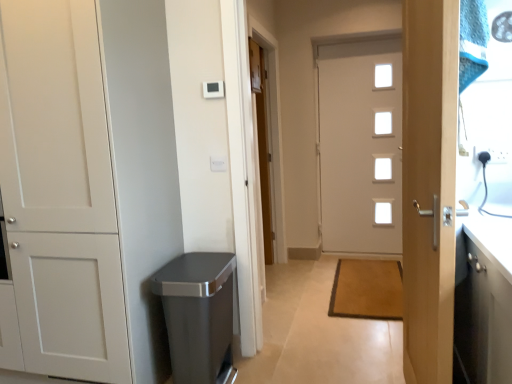
Consider the image. What is the approximate height of satin silver trash can at lower left?

satin silver trash can at lower left is 25.94 inches in height.

Locate an element on the screen. Image resolution: width=512 pixels, height=384 pixels. brown textured mat at center is located at coordinates 367,290.

Describe the element at coordinates (367, 290) in the screenshot. I see `brown textured mat at center` at that location.

How much space does white glossy door at center, which appears as the 3th door when viewed from the front, occupy vertically?

It is 6.91 feet.

You are a GUI agent. You are given a task and a screenshot of the screen. Output one action in this format:
    pyautogui.click(x=<x>, y=<y>)
    Task: Click on the light wood door handle at right, the third door positioned from the left
    The width and height of the screenshot is (512, 384).
    Given the screenshot: What is the action you would take?
    tap(429, 186)

Locate an element on the screen. Image resolution: width=512 pixels, height=384 pixels. satin silver trash can at lower left is located at coordinates (198, 315).

Does white glossy door at center, which appears as the 3th door when viewed from the front, have a lesser width compared to satin silver trash can at lower left?

Yes, white glossy door at center, which appears as the 3th door when viewed from the front, is thinner than satin silver trash can at lower left.

Is white glossy door at center, which appears as the 3th door when viewed from the front, positioned beyond the bounds of satin silver trash can at lower left?

That's correct, white glossy door at center, which appears as the 3th door when viewed from the front, is outside of satin silver trash can at lower left.

Is white glossy door at center, which appears as the 3th door when viewed from the front, at the right side of satin silver trash can at lower left?

Yes.

Is white glossy door at center, which appears as the 3th door when viewed from the front, facing towards satin silver trash can at lower left?

Yes.

Is satin silver trash can at lower left placed right next to white matte cabinet at left, arranged as the second door when viewed from the front?

No, satin silver trash can at lower left is not with white matte cabinet at left, arranged as the second door when viewed from the front.

Looking at this image, what's the angular difference between satin silver trash can at lower left and white matte cabinet at left, arranged as the second door when viewed from the front,'s facing directions?

91.8 degrees.

From the image's perspective, would you say satin silver trash can at lower left is shown under white matte cabinet at left, which ranks as the fourth door in right-to-left order?

Yes, from the image's perspective, satin silver trash can at lower left is beneath white matte cabinet at left, which ranks as the fourth door in right-to-left order.

Is white matte cabinet at left, positioned as the first door in left-to-right order, inside satin silver trash can at lower left?

Actually, white matte cabinet at left, positioned as the first door in left-to-right order, is outside satin silver trash can at lower left.

In terms of width, does white matte cabinet at left, positioned as the third door in back-to-front order, look wider or thinner when compared to light wood door handle at right, placed as the 4th door when sorted from back to front?

Clearly, white matte cabinet at left, positioned as the third door in back-to-front order, has more width compared to light wood door handle at right, placed as the 4th door when sorted from back to front.

Consider the image. Which is more to the left, white matte cabinet at left, positioned as the first door in left-to-right order, or light wood door handle at right, which ranks as the 1th door in front-to-back order?

From the viewer's perspective, white matte cabinet at left, positioned as the first door in left-to-right order, appears more on the left side.

Is white matte cabinet at left, positioned as the third door in back-to-front order, positioned far away from light wood door handle at right, placed as the 4th door when sorted from back to front?

white matte cabinet at left, positioned as the third door in back-to-front order, is far away from light wood door handle at right, placed as the 4th door when sorted from back to front.

Choose the correct answer: Is brown textured mat at center inside satin silver trash can at lower left or outside it?

brown textured mat at center cannot be found inside satin silver trash can at lower left.

Does point (366, 267) come behind point (216, 282)?

That is True.

Can you tell me how much brown textured mat at center and satin silver trash can at lower left differ in facing direction?

The angle between the facing direction of brown textured mat at center and the facing direction of satin silver trash can at lower left is 91.2 degrees.

The width and height of the screenshot is (512, 384). What are the coordinates of `dish washer on the left of brown textured mat at center` in the screenshot? It's located at (198, 315).

Is white glossy door at center, the second door from the back, shorter than white matte cabinet at left, positioned as the third door in back-to-front order?

No.

Are white glossy door at center, the second door from the back, and white matte cabinet at left, arranged as the second door when viewed from the front, far apart?

Absolutely, white glossy door at center, the second door from the back, is distant from white matte cabinet at left, arranged as the second door when viewed from the front.

From the picture: From a real-world perspective, relative to white matte cabinet at left, positioned as the third door in back-to-front order, is white glossy door at center, the second door from the back, vertically above or below?

white glossy door at center, the second door from the back, is below white matte cabinet at left, positioned as the third door in back-to-front order.

From the image's perspective, is white glossy door at center, which appears as the 3th door when viewed from the front, below white matte cabinet at left, arranged as the second door when viewed from the front?

Incorrect, from the image's perspective, white glossy door at center, which appears as the 3th door when viewed from the front, is higher than white matte cabinet at left, arranged as the second door when viewed from the front.

From a real-world perspective, is white matte cabinet at left, positioned as the first door in left-to-right order, over white glossy door at center, the second door from the back?

Yes, from a real-world perspective, white matte cabinet at left, positioned as the first door in left-to-right order, is over white glossy door at center, the second door from the back

Between white matte cabinet at left, positioned as the first door in left-to-right order, and white glossy door at center, which appears as the 3th door when viewed from the front, which one is positioned in front?

Positioned in front is white matte cabinet at left, positioned as the first door in left-to-right order.

From the image's perspective, which one is positioned lower, white matte cabinet at left, positioned as the first door in left-to-right order, or white glossy door at center, acting as the fourth door starting from the left?

white matte cabinet at left, positioned as the first door in left-to-right order, appears lower in the image.

Visually, is white matte cabinet at left, positioned as the third door in back-to-front order, positioned to the left or to the right of white glossy door at center, the 1th door when ordered from right to left?

In the image, white matte cabinet at left, positioned as the third door in back-to-front order, appears on the left side of white glossy door at center, the 1th door when ordered from right to left.

From a real-world perspective, who is located higher, white glossy door at center, positioned as the third door in right-to-left order, or white glossy door at center, the 1th door when ordered from right to left?

white glossy door at center, the 1th door when ordered from right to left.

Considering the sizes of objects white glossy door at center, the second door when ordered from left to right, and white glossy door at center, acting as the fourth door starting from the left, in the image provided, who is smaller, white glossy door at center, the second door when ordered from left to right, or white glossy door at center, acting as the fourth door starting from the left,?

white glossy door at center, the second door when ordered from left to right.

Is white glossy door at center, positioned as the third door in right-to-left order, facing towards white glossy door at center, the 1th door when ordered from right to left?

No.

Considering the sizes of white glossy door at center, positioned as the third door in right-to-left order, and white glossy door at center, acting as the fourth door starting from the left, in the image, is white glossy door at center, positioned as the third door in right-to-left order, taller or shorter than white glossy door at center, acting as the fourth door starting from the left,?

Clearly, white glossy door at center, positioned as the third door in right-to-left order, is shorter compared to white glossy door at center, acting as the fourth door starting from the left.

From the image's perspective, which door is the 4th one above the satin silver trash can at lower left? Please provide its 2D coordinates.

[(361, 146)]

This screenshot has height=384, width=512. Find the location of `door located on the left of satin silver trash can at lower left`. door located on the left of satin silver trash can at lower left is located at coordinates (59, 195).

Which object lies further to the anchor point white glossy door at center, acting as the fourth door starting from the left, white glossy door at center, marked as the fourth door in a front-to-back arrangement, or satin silver trash can at lower left?

Based on the image, satin silver trash can at lower left appears to be further to white glossy door at center, acting as the fourth door starting from the left.

Based on the photo, from the image, which object appears to be nearer to brown textured mat at center, white glossy door at center, acting as the fourth door starting from the left, or light wood door handle at right, placed as the 4th door when sorted from back to front?

white glossy door at center, acting as the fourth door starting from the left, is closer to brown textured mat at center.

Based on their spatial positions, is white glossy door at center, marked as the fourth door in a front-to-back arrangement, or light wood door handle at right, which ranks as the 1th door in front-to-back order, further from brown textured mat at center?

light wood door handle at right, which ranks as the 1th door in front-to-back order, is positioned further to the anchor brown textured mat at center.

Which object lies further to the anchor point satin silver trash can at lower left, brown textured mat at center or white glossy door at center, positioned as the third door in right-to-left order?

white glossy door at center, positioned as the third door in right-to-left order.

In the scene shown: Considering their positions, is light wood door handle at right, the third door positioned from the left, positioned closer to white glossy door at center, which appears as the 3th door when viewed from the front, than satin silver trash can at lower left?

Among the two, light wood door handle at right, the third door positioned from the left, is located nearer to white glossy door at center, which appears as the 3th door when viewed from the front.

When comparing their distances from brown textured mat at center, does white glossy door at center, acting as the fourth door starting from the left, or satin silver trash can at lower left seem closer?

The object closer to brown textured mat at center is white glossy door at center, acting as the fourth door starting from the left.

Looking at the image, which one is located further to brown textured mat at center, white matte cabinet at left, which ranks as the fourth door in right-to-left order, or light wood door handle at right, which ranks as the 1th door in front-to-back order?

white matte cabinet at left, which ranks as the fourth door in right-to-left order, is further to brown textured mat at center.

Based on their spatial positions, is white matte cabinet at left, positioned as the third door in back-to-front order, or satin silver trash can at lower left further from white glossy door at center, acting as the fourth door starting from the left?

white matte cabinet at left, positioned as the third door in back-to-front order, is positioned further to the anchor white glossy door at center, acting as the fourth door starting from the left.

Locate an element on the screen. door between white matte cabinet at left, which ranks as the fourth door in right-to-left order, and white glossy door at center, the second door when ordered from left to right, in the front-back direction is located at coordinates (361, 146).

The image size is (512, 384). I want to click on door between light wood door handle at right, the third door positioned from the left, and white glossy door at center, the second door from the back, in the front-back direction, so click(59, 195).

This screenshot has width=512, height=384. I want to click on doormat situated between white matte cabinet at left, positioned as the first door in left-to-right order, and white glossy door at center, the second door from the back, from left to right, so (367, 290).

This screenshot has width=512, height=384. Find the location of `doormat between light wood door handle at right, the third door positioned from the left, and white glossy door at center, which appears as the 1th door when viewed from the back, along the z-axis`. doormat between light wood door handle at right, the third door positioned from the left, and white glossy door at center, which appears as the 1th door when viewed from the back, along the z-axis is located at coordinates (367, 290).